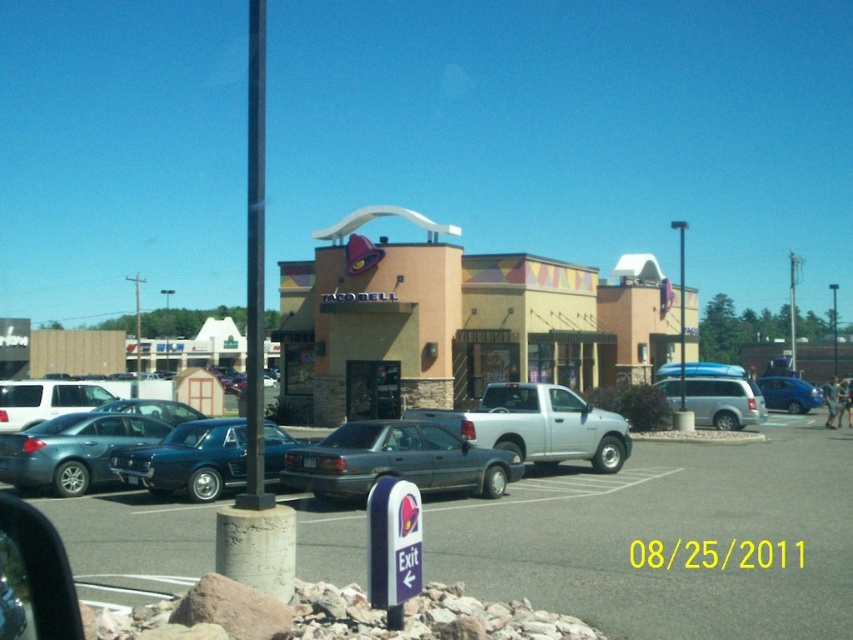
Question: Which point is closer to the camera?

Choices:
 (A) black metal pole at center
 (B) beige stucco taco bell at center
 (C) metallic blue sedan at left
 (D) brushed metal pole at center

Answer: (A)

Question: Is metallic blue sedan at left smaller than brushed metal pole at center?

Choices:
 (A) no
 (B) yes

Answer: (B)

Question: Where is black metal pole at center located in relation to blue plastic sign at lower center in the image?

Choices:
 (A) left
 (B) right

Answer: (A)

Question: Which point is closer to the camera?

Choices:
 (A) gray matte sedan at center
 (B) beige stucco taco bell at center

Answer: (A)

Question: Does gray asphalt parking lot at center lie behind matte black sedan at left?

Choices:
 (A) yes
 (B) no

Answer: (B)

Question: Which of the following is the farthest from the observer?

Choices:
 (A) shiny blue car at center
 (B) metallic blue sedan at left

Answer: (B)